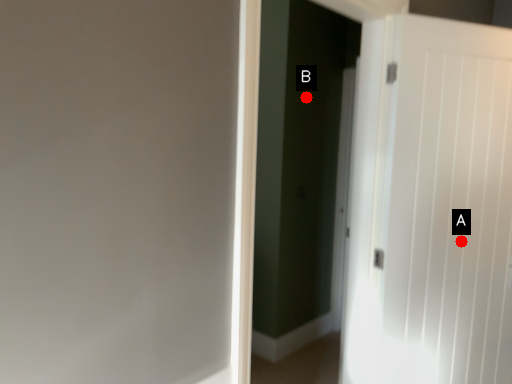
Question: Two points are circled on the image, labeled by A and B beside each circle. Which point is closer to the camera?

Choices:
 (A) A is closer
 (B) B is closer

Answer: (A)